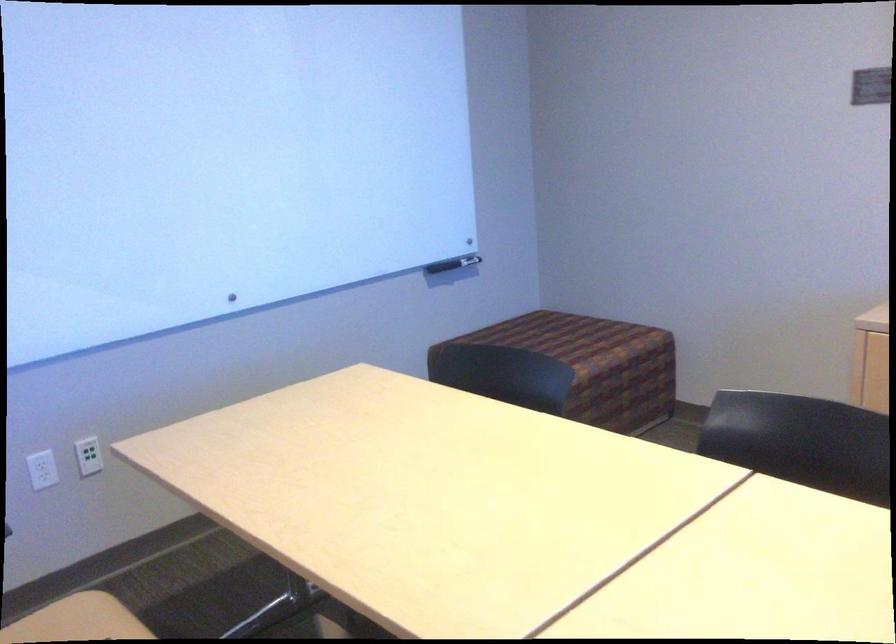
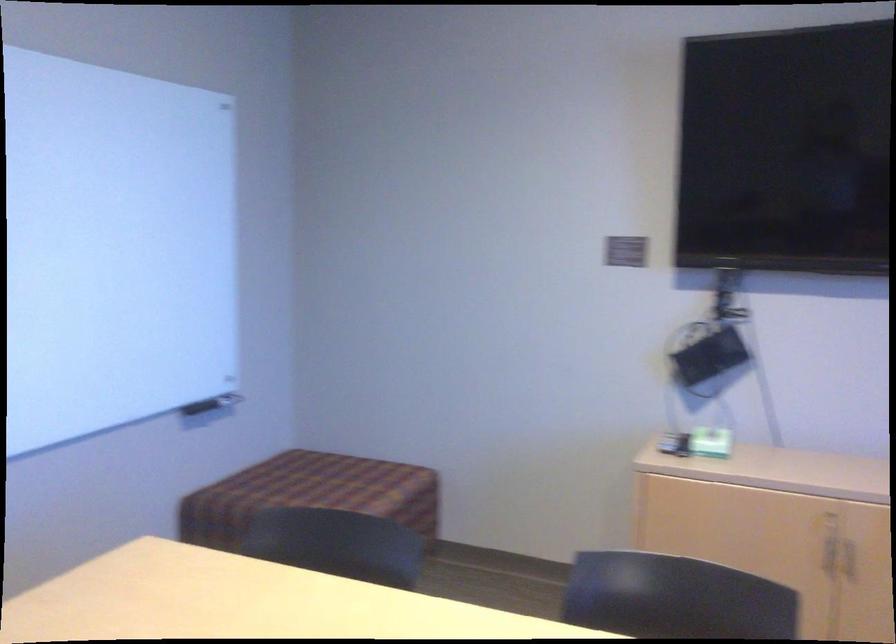
Which direction would the cameraman need to move to produce the second image?

The cameraman moved toward left, forward.